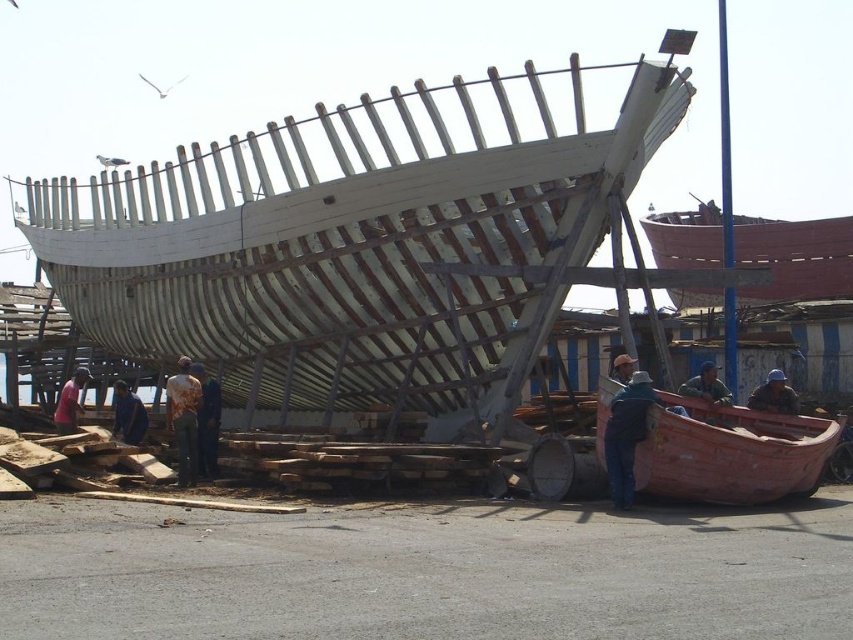
What do you see at coordinates (793, 257) in the screenshot? I see `red wooden boat at right` at bounding box center [793, 257].

Image resolution: width=853 pixels, height=640 pixels. I want to click on red wooden boat at right, so click(793, 257).

Which is in front, point (634, 420) or point (65, 401)?

Point (634, 420)

Measure the distance from denim jacket at center to matte pink shirt at left.

A distance of 133.06 feet exists between denim jacket at center and matte pink shirt at left.

Who is more forward, (612,403) or (79,380)?

Point (612,403)

Where is `denim jacket at center`? The width and height of the screenshot is (853, 640). denim jacket at center is located at coordinates (625, 435).

Is point (737, 236) positioned before point (216, 420)?

No, (737, 236) is further to viewer.

Is red wooden boat at right further to camera compared to camouflage fabric shirt at center?

Yes, red wooden boat at right is behind camouflage fabric shirt at center.

What do you see at coordinates (793, 257) in the screenshot? This screenshot has width=853, height=640. I see `red wooden boat at right` at bounding box center [793, 257].

Locate an element on the screen. The image size is (853, 640). red wooden boat at right is located at coordinates (793, 257).